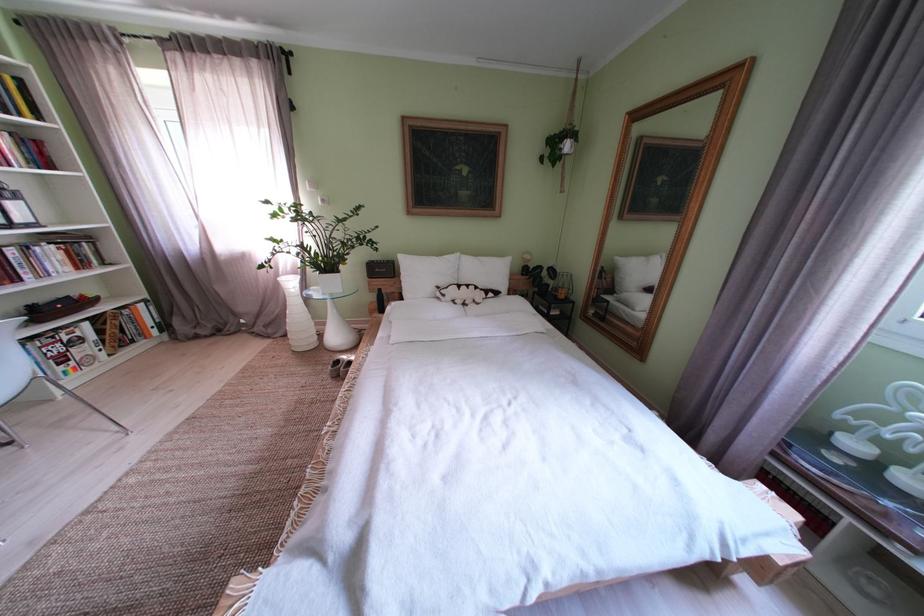
Identify the location of stuffed animal toy. (459, 294).